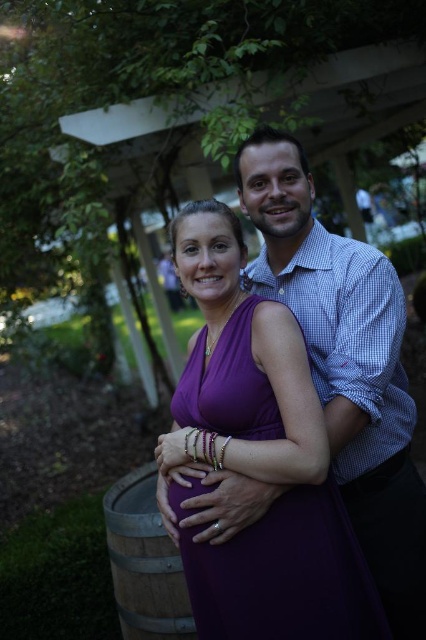
Based on the scene description, what object is located at the coordinates point (285, 576)?

The point (285, 576) corresponds to the purple satin dress at center.

You are standing 2 meters away from the camera. You want to move to the point at coordinates point (314, 552). Will you have to move forward or backward?

The distance of point (314, 552) from camera is 1.57 meters. Since you are currently 2 meters away from the camera, you need to move backward to reach the point at 1.57 meters.

You are a photographer setting up for a couple photo shoot. You see the purple satin dress at center and the wooden barrel at lower left. Which object is closer to the camera?

The purple satin dress at center is closer to the camera because it is in front of the wooden barrel at lower left.